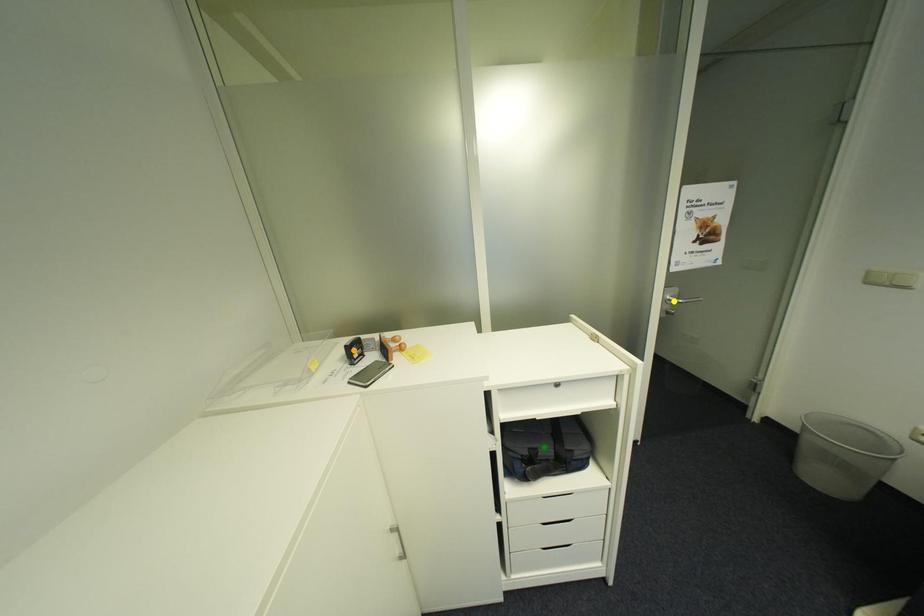
Order these from nearest to farthest:
green point | orange point | yellow point

green point, orange point, yellow point